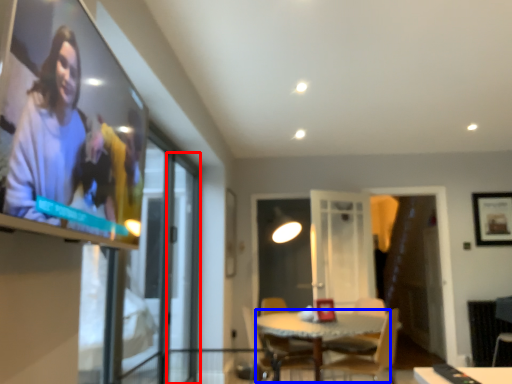
Question: Which point is closer to the camera, screen door (highlighted by a red box) or glass table (highlighted by a blue box)?

Choices:
 (A) screen door
 (B) glass table

Answer: (B)